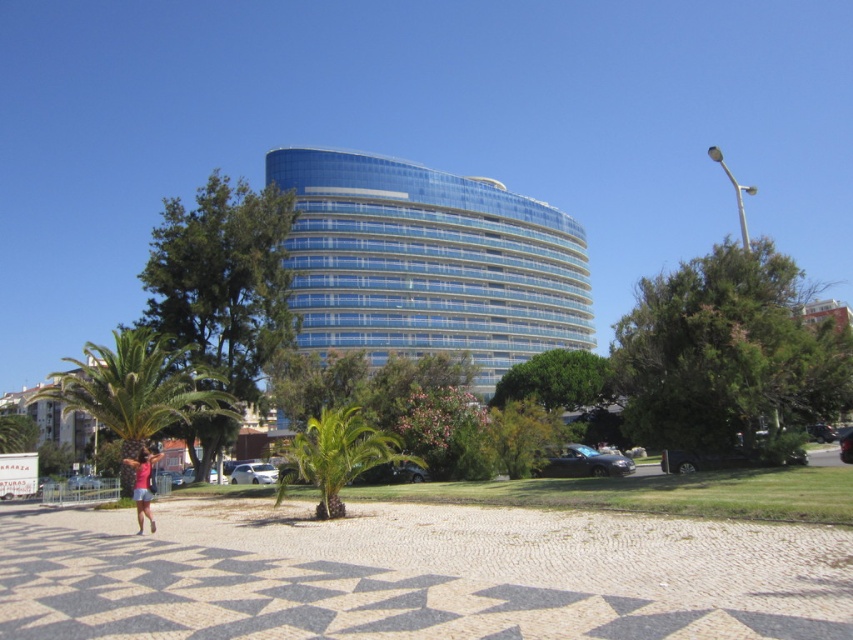
Question: Is green leafy palm tree at lower left bigger than pink fabric at lower left?

Choices:
 (A) yes
 (B) no

Answer: (A)

Question: Which object is closer to the camera taking this photo?

Choices:
 (A) pink fabric at lower left
 (B) green leafy palm tree at center
 (C) green leafy palm tree at lower left
 (D) blue glass building at center

Answer: (A)

Question: Considering the relative positions of blue glass building at center and green leafy palm tree at lower left in the image provided, where is blue glass building at center located with respect to green leafy palm tree at lower left?

Choices:
 (A) above
 (B) below

Answer: (A)

Question: Which object appears farthest from the camera in this image?

Choices:
 (A) pink fabric at lower left
 (B) green leafy palm tree at lower left

Answer: (B)

Question: Observing the image, what is the correct spatial positioning of green leafy palm tree at lower left in reference to pink fabric at lower left?

Choices:
 (A) left
 (B) right

Answer: (A)

Question: Which of the following is the closest to the observer?

Choices:
 (A) (178, 364)
 (B) (149, 516)
 (C) (381, 204)
 (D) (326, 460)

Answer: (B)